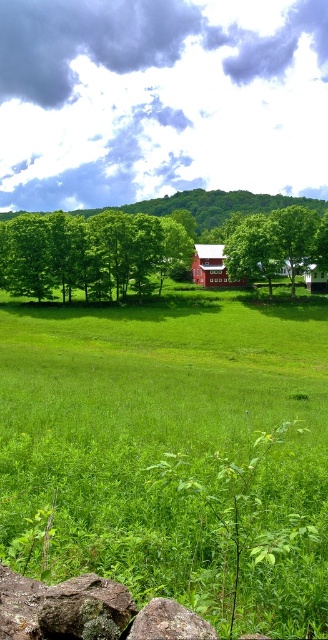
Question: Which of the following is the closest to the observer?

Choices:
 (A) (39, 632)
 (B) (224, 276)
 (C) (315, 630)

Answer: (A)

Question: Which point appears closest to the camera in this image?

Choices:
 (A) (98, 618)
 (B) (123, 269)
 (C) (198, 269)
 (D) (167, 636)

Answer: (D)

Question: Is green grassy field at center to the left of red matte barn at center from the viewer's perspective?

Choices:
 (A) no
 (B) yes

Answer: (B)

Question: Can you confirm if green grassy field at center is smaller than red matte barn at center?

Choices:
 (A) no
 (B) yes

Answer: (A)

Question: Where is rusty metallic rock at lower left located in relation to red matte barn at center in the image?

Choices:
 (A) above
 (B) below

Answer: (B)

Question: Which point appears closest to the camera in this image?

Choices:
 (A) (308, 264)
 (B) (23, 500)

Answer: (B)